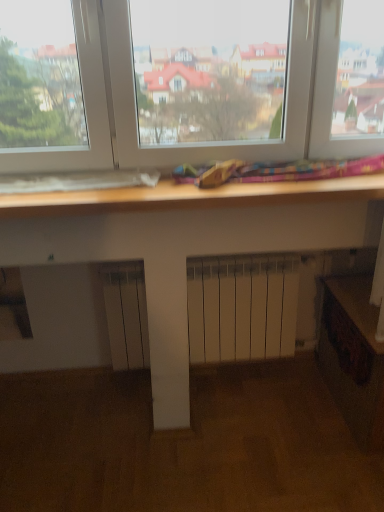
Question: Does wooden at lower right lie behind wooden drawer at lower right?

Choices:
 (A) yes
 (B) no

Answer: (B)

Question: From the image's perspective, would you say wooden at lower right is shown under wooden drawer at lower right?

Choices:
 (A) no
 (B) yes

Answer: (B)

Question: Is wooden at lower right at the right side of wooden drawer at lower right?

Choices:
 (A) no
 (B) yes

Answer: (B)

Question: Is wooden at lower right positioned beyond the bounds of wooden drawer at lower right?

Choices:
 (A) yes
 (B) no

Answer: (A)

Question: Can you confirm if wooden at lower right is thinner than wooden drawer at lower right?

Choices:
 (A) no
 (B) yes

Answer: (A)

Question: From the image's perspective, would you say wooden at lower right is positioned over wooden drawer at lower right?

Choices:
 (A) yes
 (B) no

Answer: (B)

Question: From a real-world perspective, is wooden drawer at lower right positioned under wooden at lower right based on gravity?

Choices:
 (A) no
 (B) yes

Answer: (A)

Question: Is wooden at lower right a part of wooden drawer at lower right?

Choices:
 (A) no
 (B) yes

Answer: (A)

Question: Is wooden drawer at lower right bigger than wooden at lower right?

Choices:
 (A) yes
 (B) no

Answer: (B)

Question: Could you tell me if wooden drawer at lower right is turned towards wooden at lower right?

Choices:
 (A) yes
 (B) no

Answer: (A)

Question: Is the depth of wooden drawer at lower right greater than that of wooden at lower right?

Choices:
 (A) no
 (B) yes

Answer: (B)

Question: Can you confirm if wooden drawer at lower right is positioned to the left of wooden at lower right?

Choices:
 (A) yes
 (B) no

Answer: (A)

Question: Is wooden at lower right taller or shorter than wooden drawer at lower right?

Choices:
 (A) short
 (B) tall

Answer: (B)